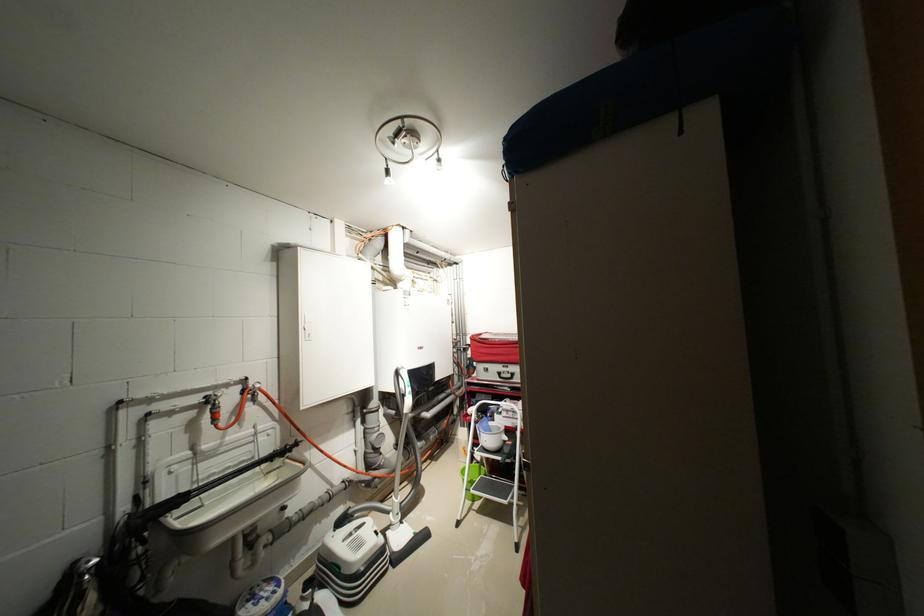
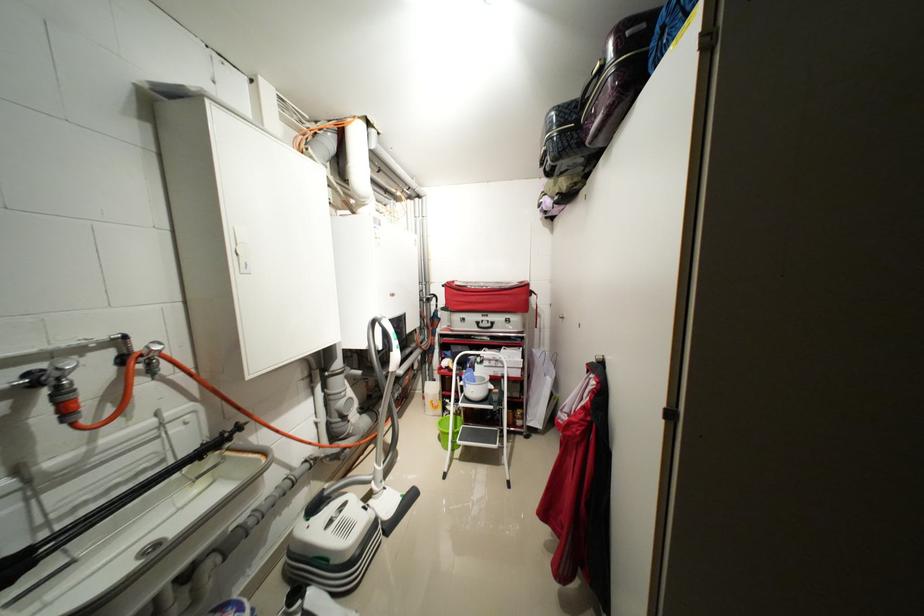
Where in the second image is the point corresponding to (515,411) from the first image?

(496, 361)